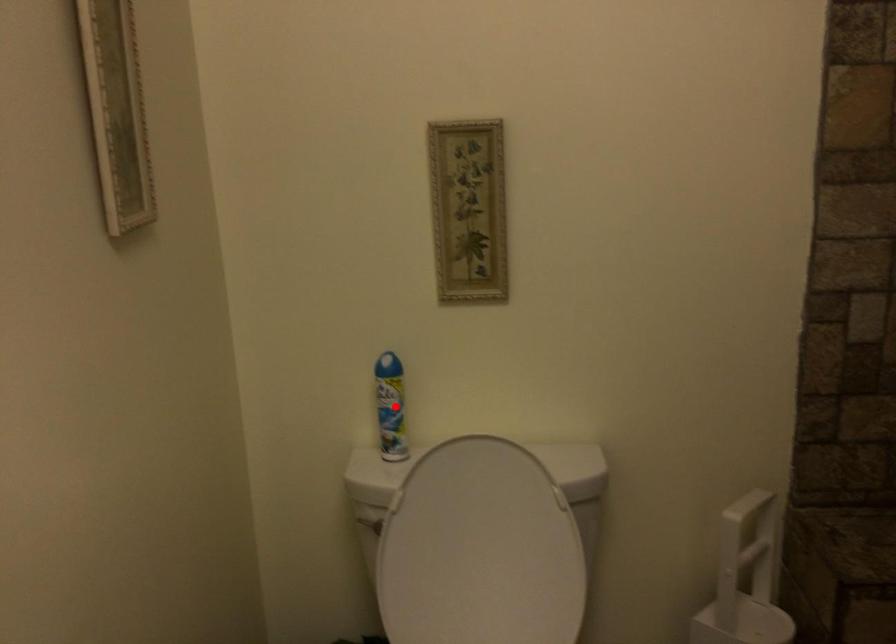
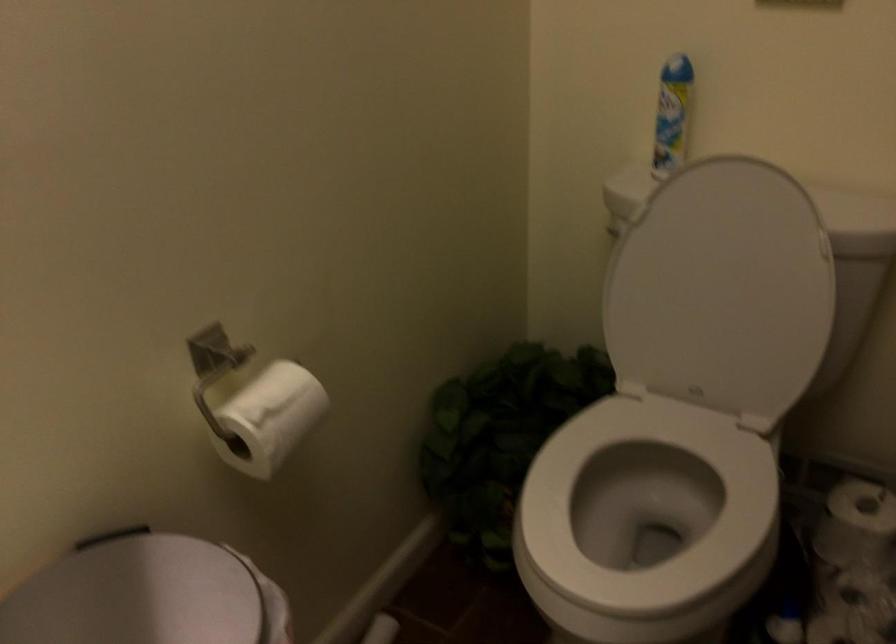
In the second image, find the point that corresponds to the highlighted location in the first image.

(672, 114)